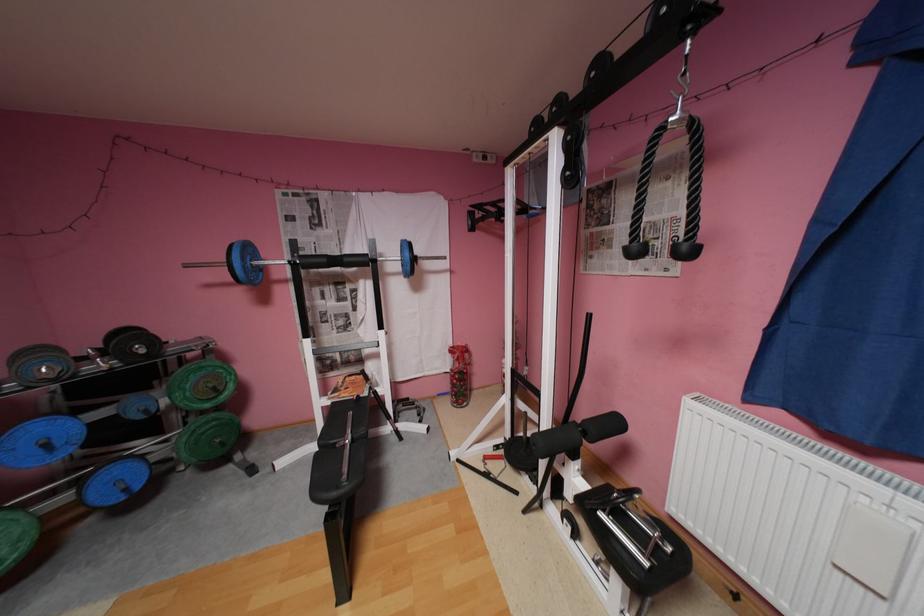
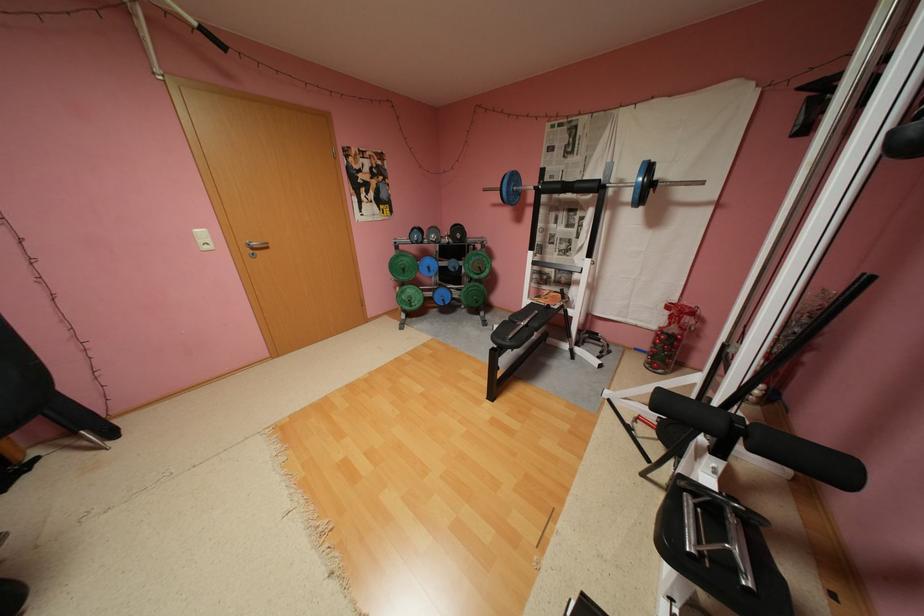
How did the camera likely rotate?

The camera's rotation is toward left-down.